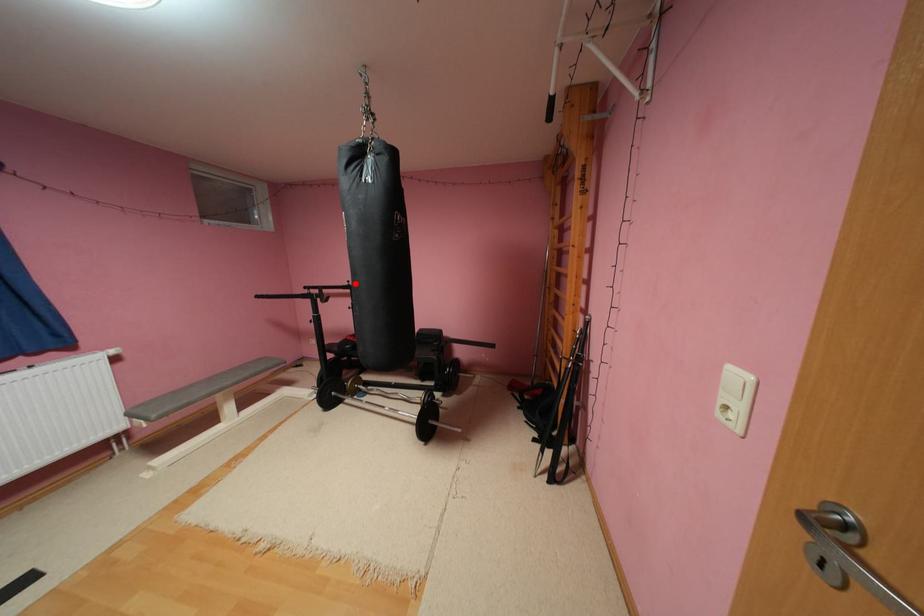
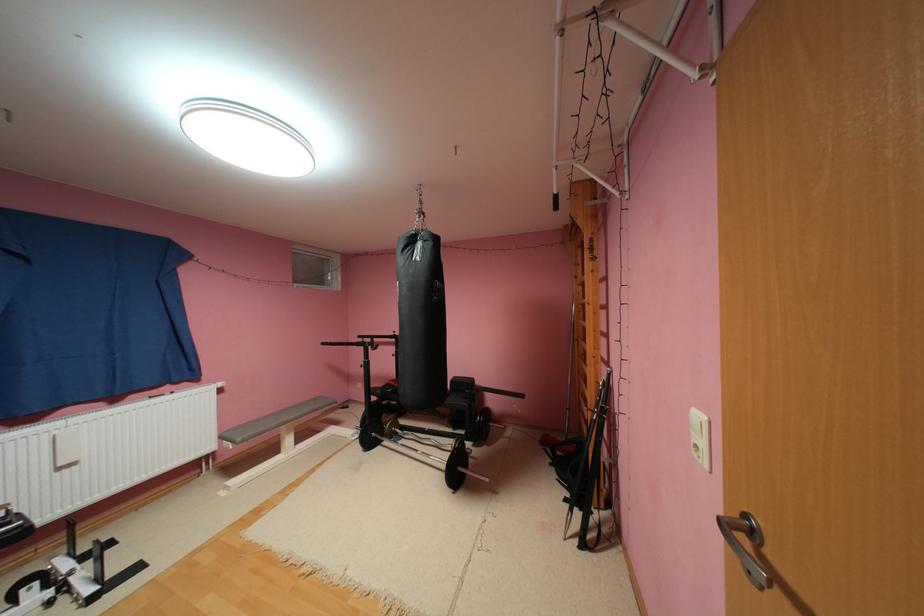
Question: I am providing you with two images of the same scene from different viewpoints. In image1, a red point is highlighted. Considering the same 3D point in image2, which of the following is correct?

Choices:
 (A) It is closer
 (B) It is farther

Answer: (B)